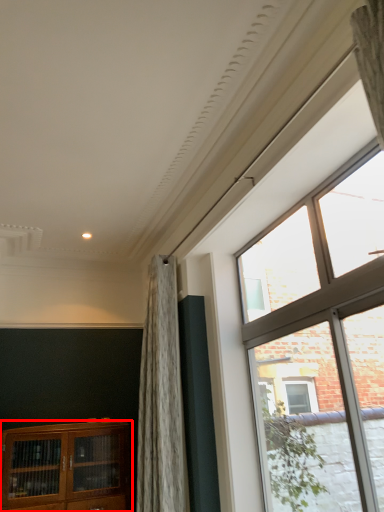
Question: Observing the image, what is the correct spatial positioning of cabinetry (annotated by the red box) in reference to window?

Choices:
 (A) right
 (B) left

Answer: (B)